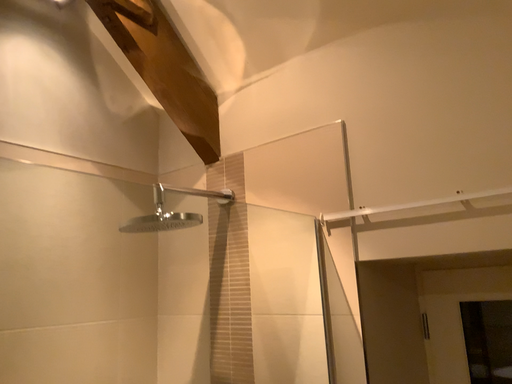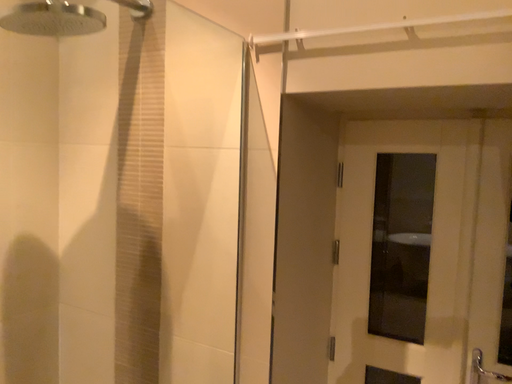
Question: How did the camera likely rotate when shooting the video?

Choices:
 (A) rotated upward
 (B) rotated downward

Answer: (B)